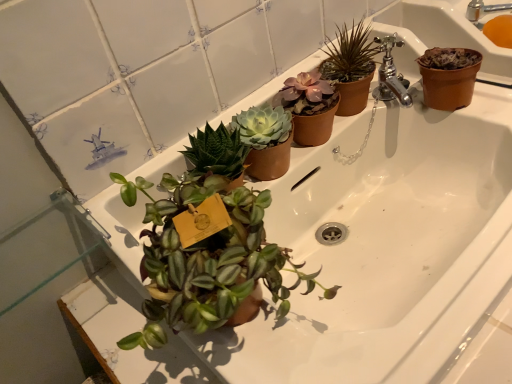
Question: Does matte brown pot at upper center have a smaller size compared to metallic silver faucet at upper right?

Choices:
 (A) yes
 (B) no

Answer: (B)

Question: From a real-world perspective, is matte brown pot at upper center positioned under metallic silver faucet at upper right based on gravity?

Choices:
 (A) yes
 (B) no

Answer: (B)

Question: Is matte brown pot at upper center bigger than metallic silver faucet at upper right?

Choices:
 (A) no
 (B) yes

Answer: (B)

Question: From the image's perspective, would you say matte brown pot at upper center is positioned over metallic silver faucet at upper right?

Choices:
 (A) yes
 (B) no

Answer: (B)

Question: Is matte brown pot at upper center facing away from metallic silver faucet at upper right?

Choices:
 (A) yes
 (B) no

Answer: (B)

Question: Does matte brown pot at upper center appear on the right side of metallic silver faucet at upper right?

Choices:
 (A) no
 (B) yes

Answer: (A)

Question: Does metallic silver faucet at upper right have a lesser width compared to matte brown pot at upper center?

Choices:
 (A) no
 (B) yes

Answer: (A)

Question: Is metallic silver faucet at upper right next to matte brown pot at upper center?

Choices:
 (A) no
 (B) yes

Answer: (A)

Question: From a real-world perspective, is metallic silver faucet at upper right under matte brown pot at upper center?

Choices:
 (A) yes
 (B) no

Answer: (A)

Question: Can you confirm if metallic silver faucet at upper right is positioned to the right of matte brown pot at upper center?

Choices:
 (A) yes
 (B) no

Answer: (A)

Question: Could matte brown pot at upper center be considered to be inside metallic silver faucet at upper right?

Choices:
 (A) no
 (B) yes

Answer: (A)

Question: Considering the relative sizes of metallic silver faucet at upper right and matte brown pot at upper center in the image provided, is metallic silver faucet at upper right wider than matte brown pot at upper center?

Choices:
 (A) yes
 (B) no

Answer: (A)

Question: From the image's perspective, is metallic silver faucet at upper right positioned above or below matte brown pot at upper center?

Choices:
 (A) below
 (B) above

Answer: (B)